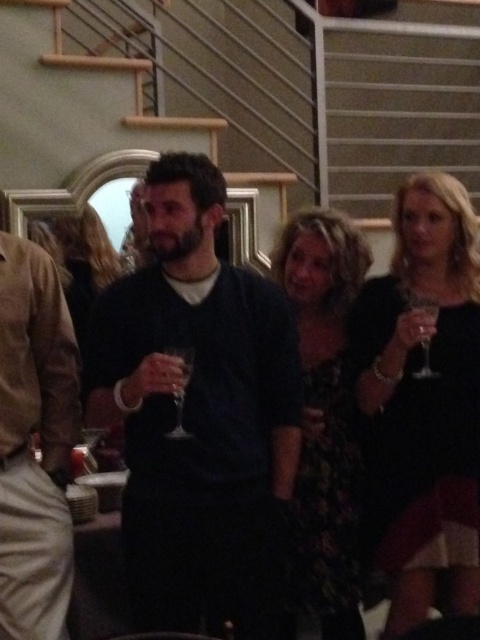
Question: Can you confirm if dark blue sweater at center is bigger than matte black sweater at center?

Choices:
 (A) no
 (B) yes

Answer: (B)

Question: Which is farther from the clear glass wine glass at center?

Choices:
 (A) dark blue sweater at center
 (B) floral dress at center
 (C) matte black sweater at center
 (D) black satin dress at right

Answer: (D)

Question: Estimate the real-world distances between objects in this image. Which object is closer to the floral dress at center?

Choices:
 (A) clear glass wine glass at right
 (B) black satin dress at right
 (C) clear glass wine glass at center
 (D) matte black sweater at center

Answer: (B)

Question: Which of the following is the closest to the observer?

Choices:
 (A) (468, 540)
 (B) (324, 356)

Answer: (A)

Question: Is dark blue sweater at center thinner than floral dress at center?

Choices:
 (A) no
 (B) yes

Answer: (A)

Question: Is black satin dress at right closer to the viewer compared to clear glass wine glass at right?

Choices:
 (A) no
 (B) yes

Answer: (B)